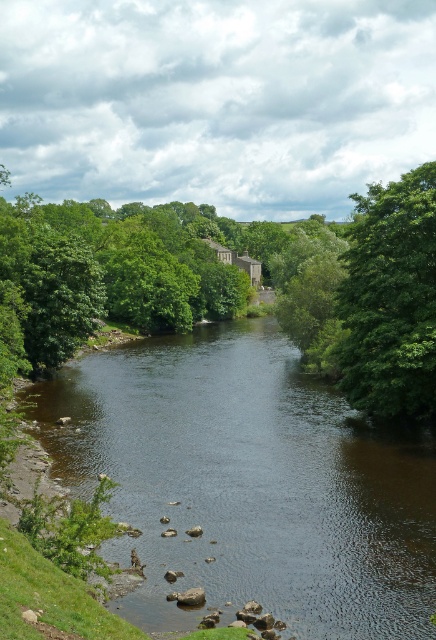
Between dark brown water at center and green leafy tree at upper right, which one has less height?

With less height is dark brown water at center.

Can you confirm if dark brown water at center is wider than green leafy tree at upper right?

Yes, dark brown water at center is wider than green leafy tree at upper right.

Is point (152, 483) positioned after point (395, 216)?

No.

At what (x,y) coordinates should I click in order to perform the action: click on dark brown water at center. Please return your answer as a coordinate pair (x, y). Looking at the image, I should click on (248, 483).